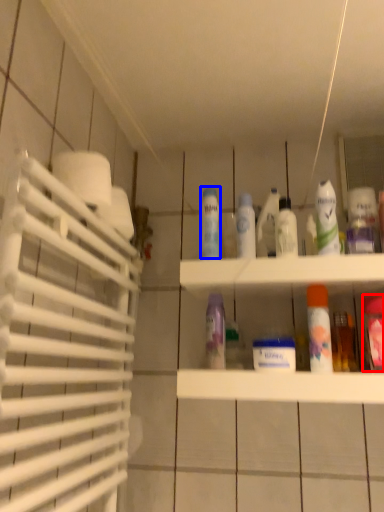
Question: Which object appears closest to the camera in this image, mouthwash (highlighted by a red box) or cleaning product (highlighted by a blue box)?

Choices:
 (A) mouthwash
 (B) cleaning product

Answer: (A)